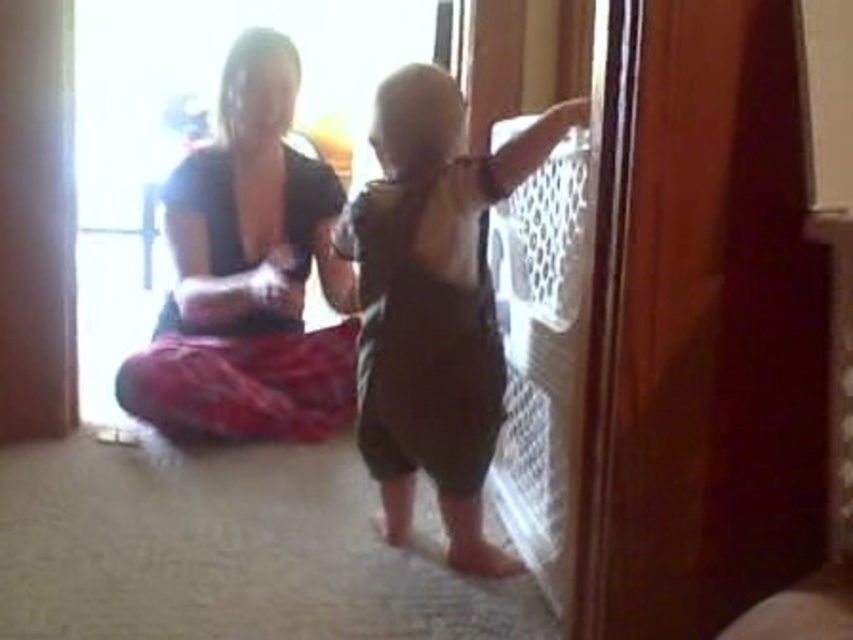
Question: In this image, where is matte black shirt at center located relative to dark brown cotton onesie at right?

Choices:
 (A) right
 (B) left

Answer: (B)

Question: Does matte black shirt at center come in front of dark brown cotton onesie at right?

Choices:
 (A) no
 (B) yes

Answer: (A)

Question: Which point is closer to the camera?

Choices:
 (A) dark brown cotton onesie at right
 (B) matte black shirt at center

Answer: (A)

Question: Is matte black shirt at center to the left of dark brown cotton onesie at right from the viewer's perspective?

Choices:
 (A) no
 (B) yes

Answer: (B)